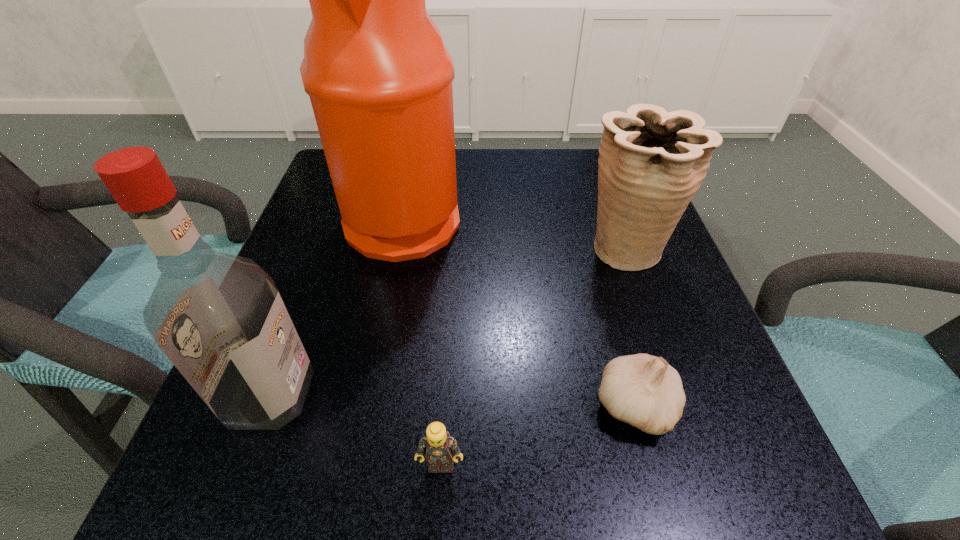
I want to click on free region that satisfies the following two spatial constraints: 1. from the spout of the third shortest object; 2. on the left side of the water jug, so click(x=397, y=248).